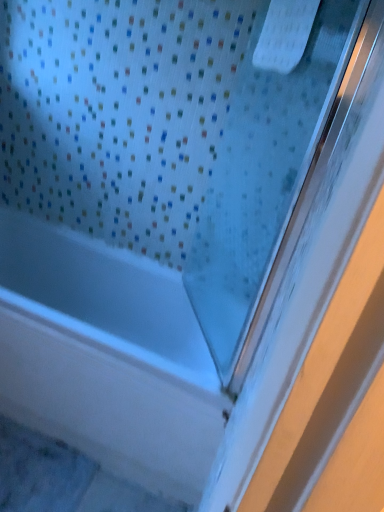
You are a GUI agent. You are given a task and a screenshot of the screen. Output one action in this format:
    pyautogui.click(x=<x>, y=<y>)
    Task: Click on the transparent glass bathtub at upper left
    This screenshot has height=512, width=384.
    Given the screenshot: What is the action you would take?
    pyautogui.click(x=106, y=357)

Describe the element at coordinates (106, 357) in the screenshot. The image size is (384, 512). I see `transparent glass bathtub at upper left` at that location.

You are a GUI agent. You are given a task and a screenshot of the screen. Output one action in this format:
    pyautogui.click(x=<x>, y=<y>)
    Task: Click on the transparent glass bathtub at upper left
    This screenshot has width=384, height=512.
    Given the screenshot: What is the action you would take?
    pyautogui.click(x=106, y=357)